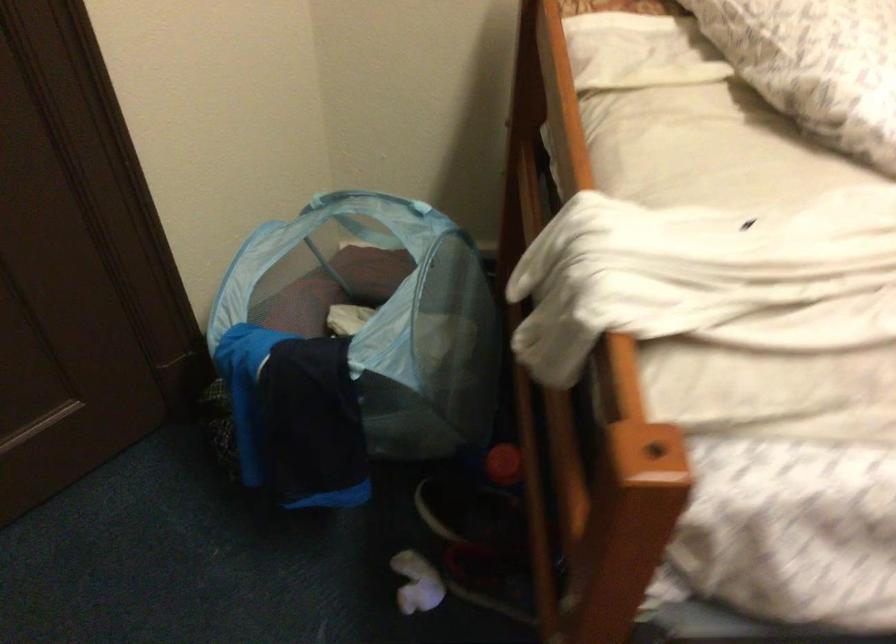
Find the location of a particular element. small orange ball is located at coordinates (504, 464).